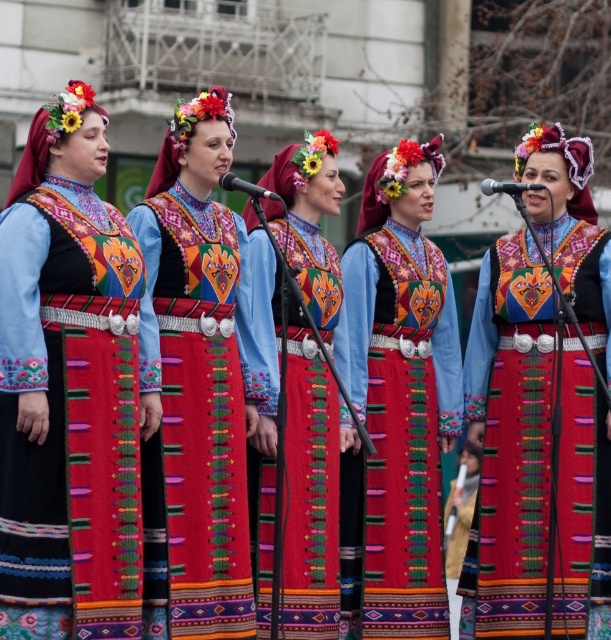
You are a photographer trying to capture the group of women in their traditional attire. You notice a specific point at coordinates point (x=70, y=384). Where exactly is this point located in relation to the women?

The point (x=70, y=384) is on the matte black dress at center, so it is located on the central woman in the group.

You are a photographer trying to capture a clear shot of both the matte black dress at center and the matte blue dress at center. Since they are positioned in a line, which dress should you focus on first to ensure it appears in front in the photo?

The matte black dress at center is closer to the viewer than the matte blue dress at center, so you should focus on the matte black dress at center first to ensure it appears in front in the photo.